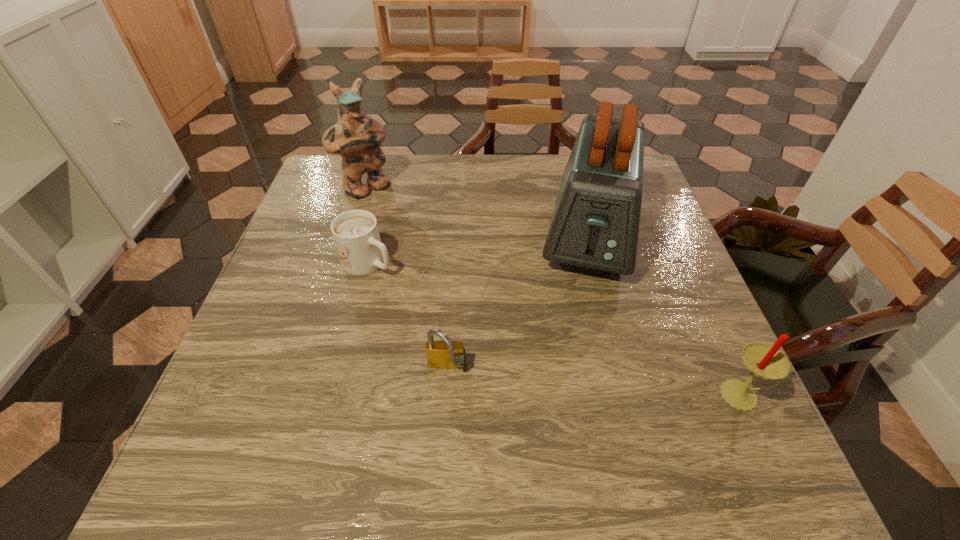
I want to click on free space at the left edge, so click(322, 268).

You are a GUI agent. You are given a task and a screenshot of the screen. Output one action in this format:
    pyautogui.click(x=<x>, y=<y>)
    Task: Click on the vacant space at the near right corner of the desktop
    The image size is (960, 540).
    Given the screenshot: What is the action you would take?
    pyautogui.click(x=665, y=398)

This screenshot has width=960, height=540. What are the coordinates of `unoccupied position between the figurine and the second object from right to left` in the screenshot? It's located at (478, 212).

Identify the location of unoccupied position between the padlock and the third shortest object. (595, 382).

Where is `free area in between the rightmost object and the figurine`? Image resolution: width=960 pixels, height=540 pixels. free area in between the rightmost object and the figurine is located at coordinates (554, 292).

Image resolution: width=960 pixels, height=540 pixels. I want to click on free point between the fourth object from left to right and the third object from left to right, so click(x=518, y=302).

Locate an element on the screen. This screenshot has height=540, width=960. vacant area between the figurine and the candle is located at coordinates (554, 292).

Locate an element on the screen. vacant region between the figurine and the padlock is located at coordinates click(406, 279).

I want to click on empty location between the third object from right to left and the figurine, so click(406, 279).

This screenshot has width=960, height=540. Identify the location of free space between the figurine and the rightmost object. (554, 292).